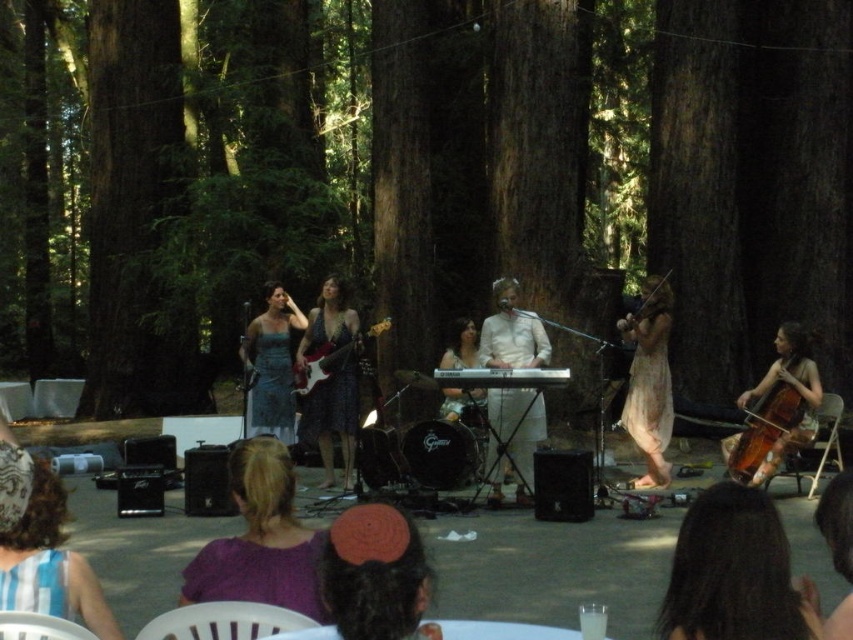
You are a photographer at the live music performance. You want to capture a closeup of the brown fabric headband at center and the matte blue dress at center. Which one is positioned lower in the frame?

The brown fabric headband at center is below the matte blue dress at center, so it is positioned lower in the frame.

Looking at this image, you are a photographer standing behind the stage. You want to take a picture of the matte black guitar at center and the light beige fabric dress at center. The camera you are using has a maximum focus range of 2 meters. Will both objects be in focus?

The matte black guitar at center is 2.31 meters away from the light beige fabric dress at center. Since the distance between them exceeds the camera maximum focus range of 2 meters, the camera cannot focus on both objects simultaneously.

You are a photographer at the live music performance. You want to capture a closeup shot of the brown fabric headband at center and the matte blue dress at center. Which object should you zoom in on more to ensure both are in frame?

The brown fabric headband at center is narrower than the matte blue dress at center, so you should zoom in more on the matte blue dress at center to ensure both fit in the frame.